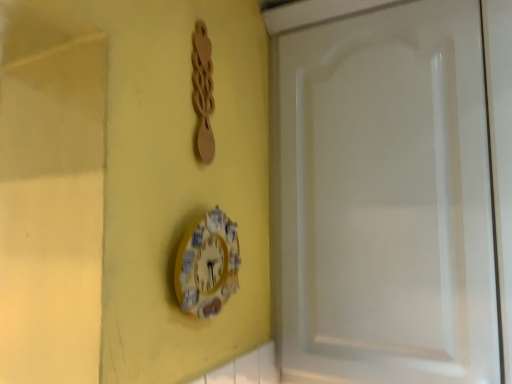
Question: Do you think yellow painted wood clock at center is within white glossy cabinet door at right, or outside of it?

Choices:
 (A) inside
 (B) outside

Answer: (B)

Question: Considering the positions of yellow painted wood clock at center and white glossy cabinet door at right in the image, is yellow painted wood clock at center taller or shorter than white glossy cabinet door at right?

Choices:
 (A) short
 (B) tall

Answer: (A)

Question: From the image's perspective, is yellow painted wood clock at center positioned above or below white glossy cabinet door at right?

Choices:
 (A) below
 (B) above

Answer: (A)

Question: In terms of height, does white glossy cabinet door at right look taller or shorter compared to yellow painted wood clock at center?

Choices:
 (A) tall
 (B) short

Answer: (A)

Question: Considering the positions of white glossy cabinet door at right and yellow painted wood clock at center in the image, is white glossy cabinet door at right wider or thinner than yellow painted wood clock at center?

Choices:
 (A) wide
 (B) thin

Answer: (A)

Question: Relative to yellow painted wood clock at center, is white glossy cabinet door at right in front or behind?

Choices:
 (A) behind
 (B) front

Answer: (A)

Question: From a real-world perspective, relative to yellow painted wood clock at center, is white glossy cabinet door at right vertically above or below?

Choices:
 (A) below
 (B) above

Answer: (B)